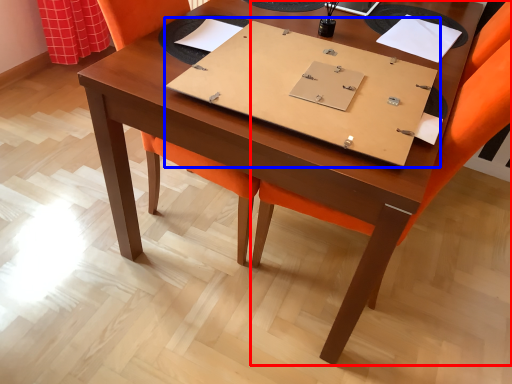
Question: Which object is further to the camera taking this photo, chair (highlighted by a red box) or notebook (highlighted by a blue box)?

Choices:
 (A) chair
 (B) notebook

Answer: (B)